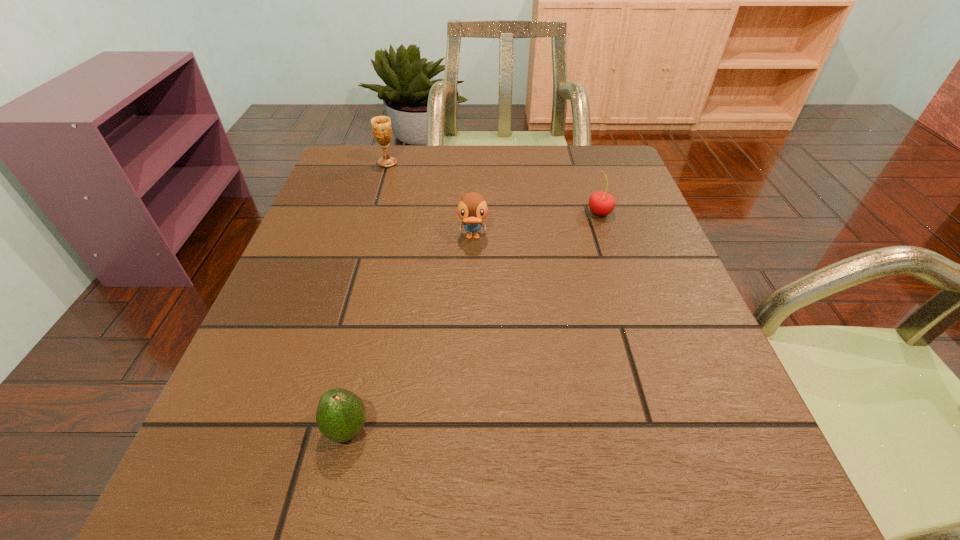
Identify which object is the third nearest to the chalice. Please provide its 2D coordinates. Your answer should be formatted as a tuple, i.e. [(x, y)], where the tuple contains the x and y coordinates of a point satisfying the conditions above.

[(340, 416)]